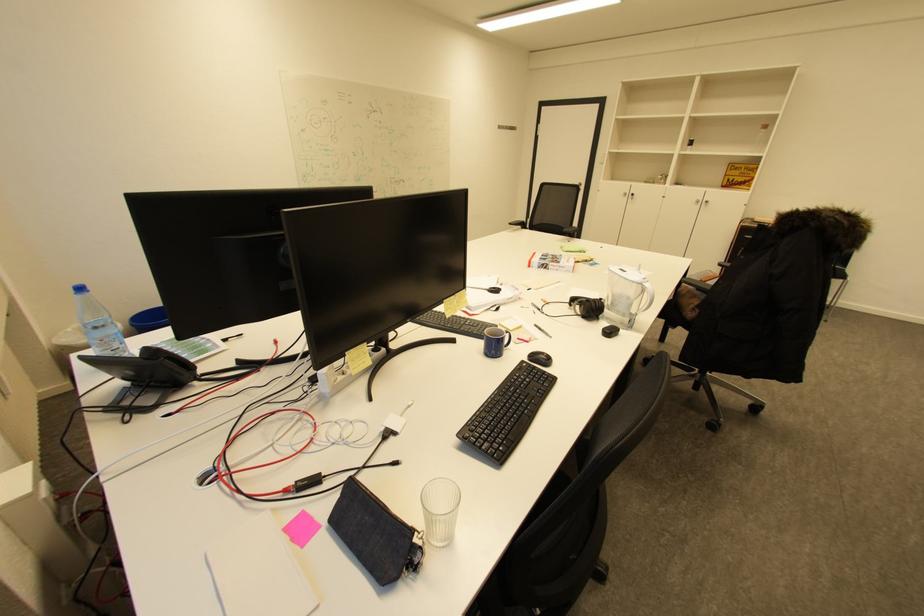
Find the location of `black keyboard`. black keyboard is located at coordinates (506, 411).